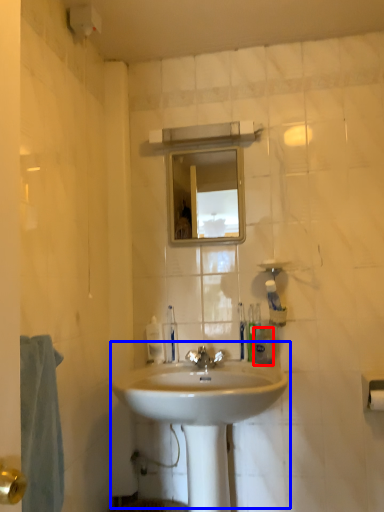
Question: Which object appears closest to the camera in this image, toiletry (highlighted by a red box) or sink (highlighted by a blue box)?

Choices:
 (A) toiletry
 (B) sink

Answer: (B)